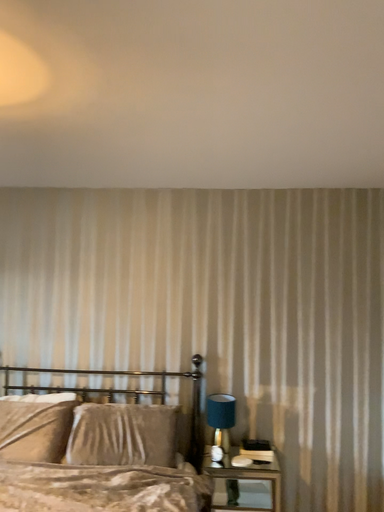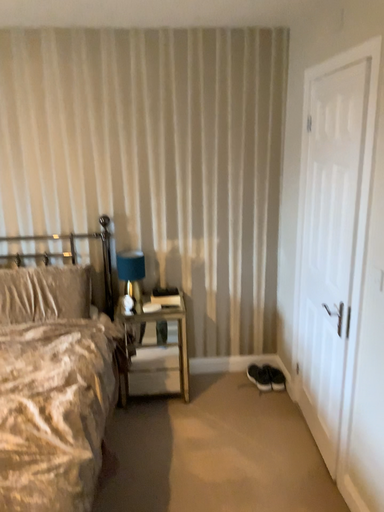
Question: How did the camera likely rotate when shooting the video?

Choices:
 (A) rotated right
 (B) rotated left

Answer: (A)